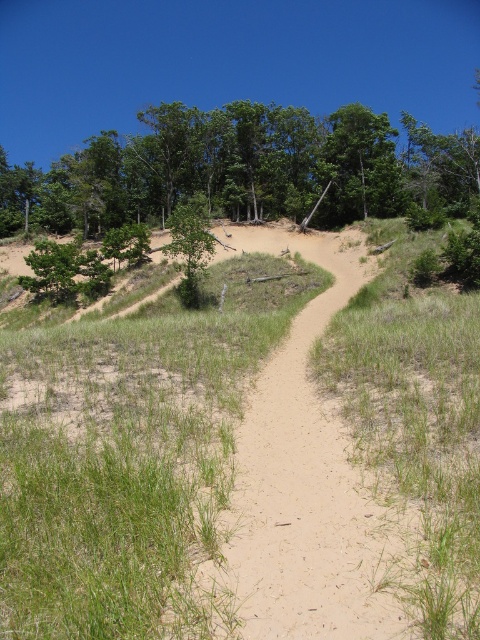
You are a hiker standing at the starting point of the sandy path. You want to reach the green grass at center. According to the coordinates provided, in which direction should you head from your current position?

The green grass at center is located at coordinates point (x=241, y=456), so you should head towards the center of the image to reach it.

You are a hiker who wants to take a shortcut through the green grass at center and the green matte tree at center. Which object is located below the other?

The green grass at center is positioned under the green matte tree at center, so the grass is below the tree.

Looking at this image, you are a hiker standing on the sandy path and want to reach the green leafy tree at upper center. Which direction should you move relative to the green grass at center?

To reach the green leafy tree at upper center, you should move behind the green grass at center since the green grass at center is in front of the green leafy tree at upper center, meaning the tree is behind the grass from your perspective.